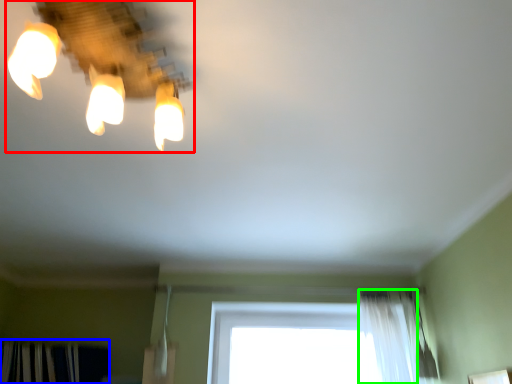
Question: Based on their relative distances, which object is nearer to lamp (highlighted by a red box)? Choose from curtain (highlighted by a blue box) and shower curtain (highlighted by a green box).

Choices:
 (A) curtain
 (B) shower curtain

Answer: (B)